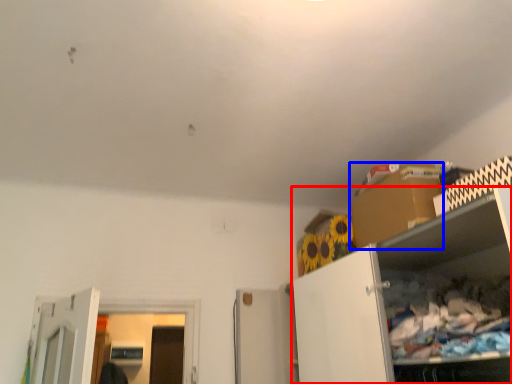
Question: Which of the following is the farthest to the observer, cabinetry (highlighted by a red box) or cardboard box (highlighted by a blue box)?

Choices:
 (A) cabinetry
 (B) cardboard box

Answer: (B)